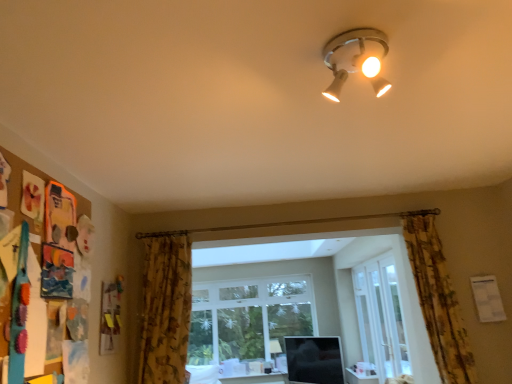
Question: Is matte white table at lower center outside of floral fabric curtain at right, which is the 2th curtain in left-to-right order?

Choices:
 (A) yes
 (B) no

Answer: (A)

Question: Is matte white table at lower center facing away from floral fabric curtain at right, which is the 2th curtain in left-to-right order?

Choices:
 (A) yes
 (B) no

Answer: (B)

Question: Is matte white table at lower center taller than floral fabric curtain at right, arranged as the 1th curtain when viewed from the right?

Choices:
 (A) yes
 (B) no

Answer: (B)

Question: Considering the relative positions of matte white table at lower center and floral fabric curtain at right, which is the 2th curtain in left-to-right order, in the image provided, is matte white table at lower center to the left of floral fabric curtain at right, which is the 2th curtain in left-to-right order, from the viewer's perspective?

Choices:
 (A) no
 (B) yes

Answer: (B)

Question: Does matte white table at lower center have a larger size compared to floral fabric curtain at right, arranged as the 1th curtain when viewed from the right?

Choices:
 (A) yes
 (B) no

Answer: (B)

Question: Is clear glass door at center bigger or smaller than clear glass window at center?

Choices:
 (A) big
 (B) small

Answer: (B)

Question: From the image's perspective, relative to clear glass window at center, is clear glass door at center above or below?

Choices:
 (A) above
 (B) below

Answer: (A)

Question: Considering the positions of point (394, 299) and point (292, 316), is point (394, 299) closer or farther from the camera than point (292, 316)?

Choices:
 (A) closer
 (B) farther

Answer: (A)

Question: Visually, is clear glass door at center positioned to the left or to the right of clear glass window at center?

Choices:
 (A) right
 (B) left

Answer: (A)

Question: Does point pyautogui.click(x=272, y=377) appear closer or farther from the camera than point pyautogui.click(x=238, y=299)?

Choices:
 (A) farther
 (B) closer

Answer: (B)

Question: Considering their positions, is matte white table at lower center located in front of or behind clear glass window at center?

Choices:
 (A) front
 (B) behind

Answer: (A)

Question: Is matte white table at lower center wider or thinner than clear glass window at center?

Choices:
 (A) thin
 (B) wide

Answer: (A)

Question: From the image's perspective, is matte white table at lower center above or below clear glass window at center?

Choices:
 (A) above
 (B) below

Answer: (B)

Question: In terms of height, does matte white table at lower center look taller or shorter compared to matte white ceiling light at upper center, which appears as the 2th lamp when viewed from the back?

Choices:
 (A) tall
 (B) short

Answer: (B)

Question: In terms of width, does matte white table at lower center look wider or thinner when compared to matte white ceiling light at upper center, which ranks as the 1th lamp in top-to-bottom order?

Choices:
 (A) thin
 (B) wide

Answer: (A)